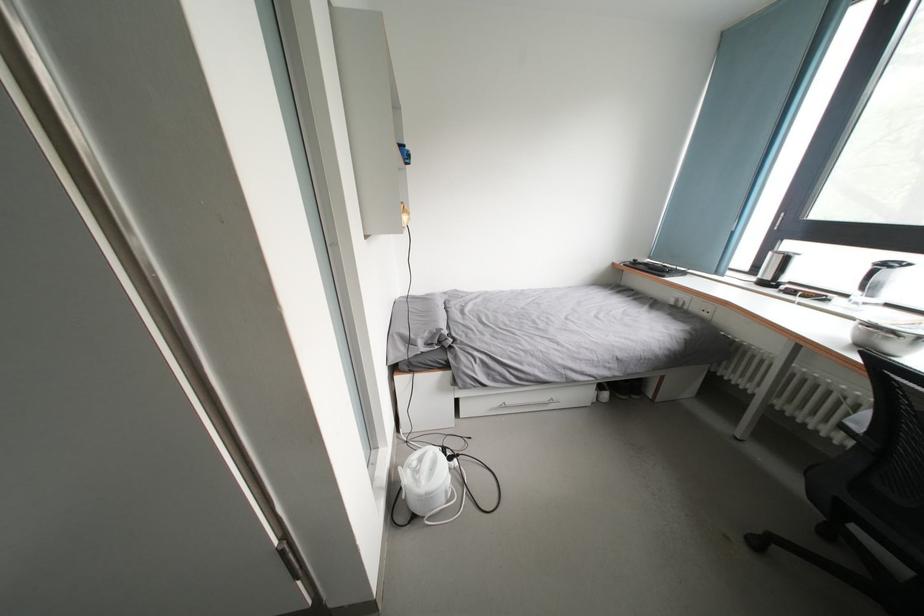
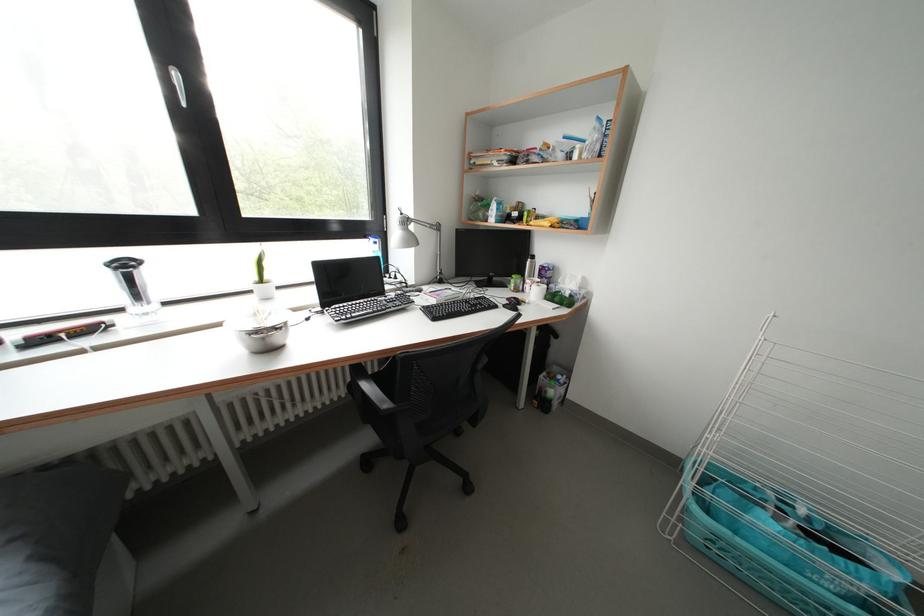
Locate, in the second image, the point that corresponds to point (877, 331) in the first image.

(262, 337)